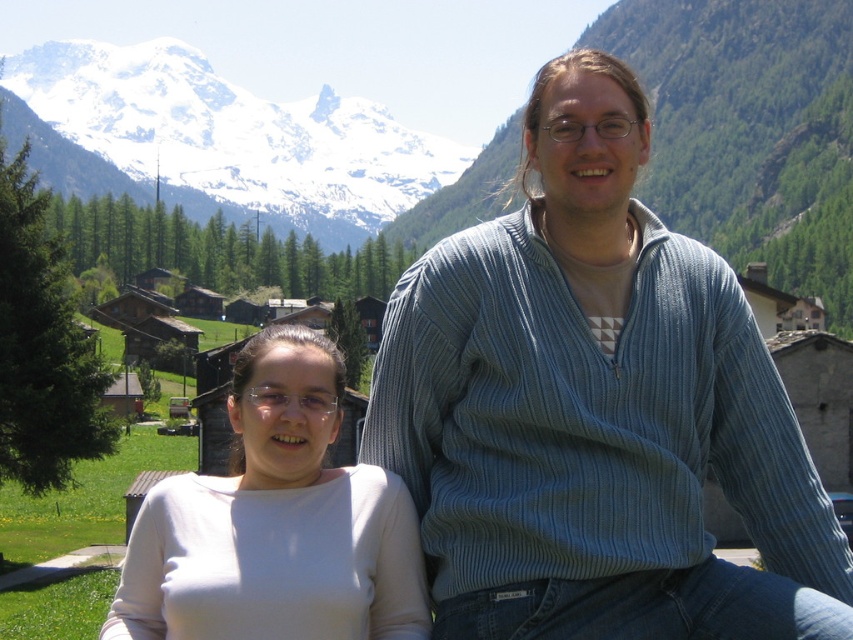
You are a photographer trying to capture a photo of the snowy mountain at upper left. You notice the white matte shirt at lower left is blocking part of the mountain in your viewfinder. Can you adjust your position to avoid the shirt blocking the mountain?

The white matte shirt at lower left is positioned under the snowy mountain at upper left, so moving the camera slightly upward or to the side should allow you to frame the snowy mountain at upper left without the shirt blocking it.

You are a photographer trying to frame a shot of the blue striped sweater at center and the white matte shirt at lower left. Which object should you zoom in on to focus on the narrower one?

The blue striped sweater at center has a lesser width compared to the white matte shirt at lower left, so you should zoom in on the blue striped sweater at center to focus on the narrower one.

You are taking a photo of two people sitting in front of the mountains. You want to focus on the person closer to the camera. Which point should you focus on, point (412, 545) or point (83, 147)?

You should focus on point (412, 545) because it is closer to the camera than point (83, 147).